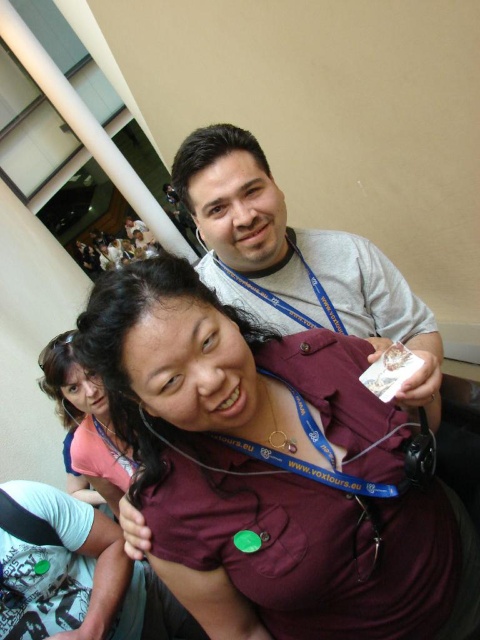
Does gray lanyard at upper center appear over blue fabric lanyard at upper center?

No.

Between gray lanyard at upper center and blue fabric lanyard at upper center, which one is positioned lower?

gray lanyard at upper center

Does point (361, 252) come in front of point (261, 292)?

That is True.

Identify the location of gray lanyard at upper center. (300, 259).

Who is more distant from viewer, (381, 477) or (290, 296)?

The point (290, 296) is behind.

Between point (96, 298) and point (284, 208), which one is positioned in front?

Point (96, 298) is in front.

Find the location of a particular element. This screenshot has height=640, width=480. maroon fabric shirt at center is located at coordinates (273, 472).

Is point (75, 420) less distant than point (290, 230)?

That is False.

Is point (84, 371) positioned behind point (235, 257)?

Yes.

Describe the element at coordinates (85, 420) in the screenshot. I see `matte burgundy shirt at center` at that location.

Identify the location of matte burgundy shirt at center. (85, 420).